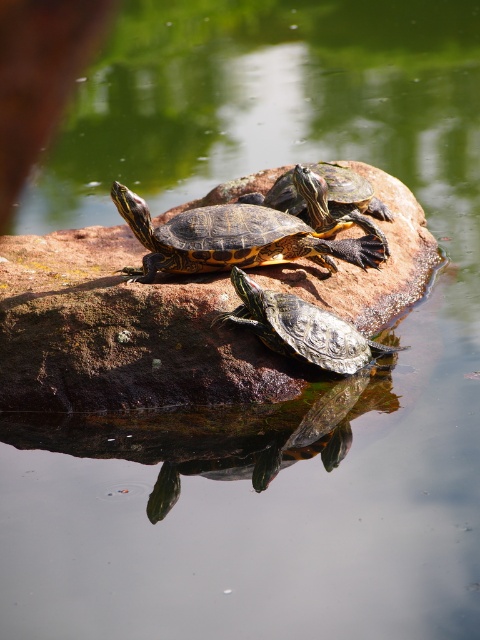
Question: Is patterned shell turtle at center to the right of shiny green tortoise at center from the viewer's perspective?

Choices:
 (A) yes
 (B) no

Answer: (B)

Question: Which point is farther from the camera taking this photo?

Choices:
 (A) (344, 326)
 (B) (387, 252)
 (C) (245, 214)

Answer: (B)

Question: Among these objects, which one is nearest to the camera?

Choices:
 (A) shiny brown tortoise at center
 (B) shiny green tortoise at center
 (C) patterned shell turtle at center

Answer: (B)

Question: Among these points, which one is nearest to the camera?

Choices:
 (A) (360, 180)
 (B) (326, 211)
 (C) (338, 336)

Answer: (C)

Question: Can you confirm if patterned shell turtle at center is wider than shiny brown tortoise at center?

Choices:
 (A) no
 (B) yes

Answer: (B)

Question: Does shiny green tortoise at center lie behind shiny brown tortoise at center?

Choices:
 (A) yes
 (B) no

Answer: (B)